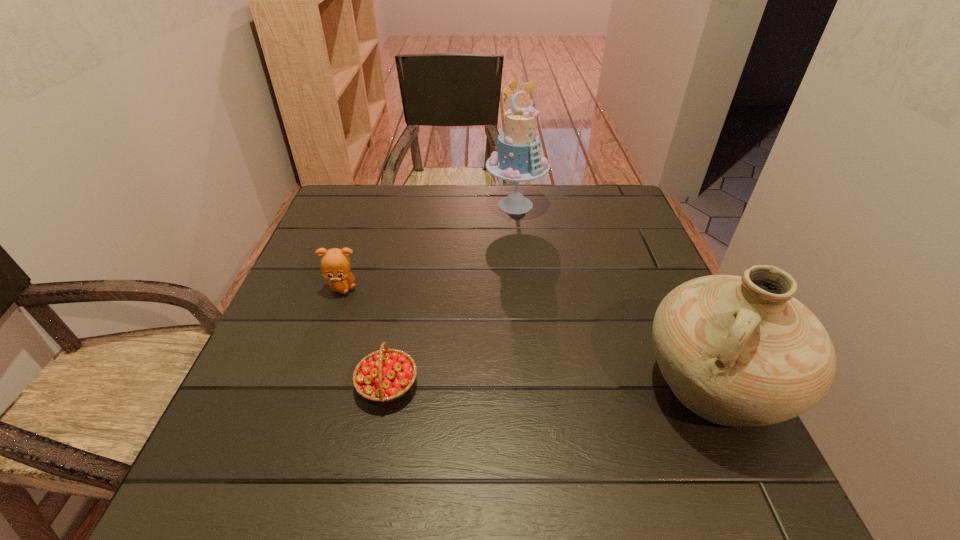
You are a GUI agent. You are given a task and a screenshot of the screen. Output one action in this format:
    pyautogui.click(x=<x>, y=<y>)
    Task: Click on the second object from left to right
    The width and height of the screenshot is (960, 540).
    Given the screenshot: What is the action you would take?
    pyautogui.click(x=385, y=375)

At what (x,y) coordinates should I click in order to perform the action: click on the shortest object. Please return your answer as a coordinate pair (x, y). The width and height of the screenshot is (960, 540). Looking at the image, I should click on (385, 375).

This screenshot has height=540, width=960. Identify the location of the rightmost object. (736, 350).

Locate an element on the screen. The width and height of the screenshot is (960, 540). the second tallest object is located at coordinates (736, 350).

I want to click on cake, so click(x=518, y=159).

You are a GUI agent. You are given a task and a screenshot of the screen. Output one action in this format:
    pyautogui.click(x=<x>, y=<y>)
    Task: Click on the farthest object
    The width and height of the screenshot is (960, 540).
    Given the screenshot: What is the action you would take?
    pyautogui.click(x=518, y=159)

At what (x,y) coordinates should I click in order to perform the action: click on the third tallest object. Please return your answer as a coordinate pair (x, y). This screenshot has width=960, height=540. Looking at the image, I should click on (335, 264).

Identify the location of the leftmost object. (335, 264).

Identify the location of free point located on the left of the second object from left to right. The height and width of the screenshot is (540, 960). (325, 384).

The image size is (960, 540). Identify the location of vacant space located on the back of the second tallest object. (680, 315).